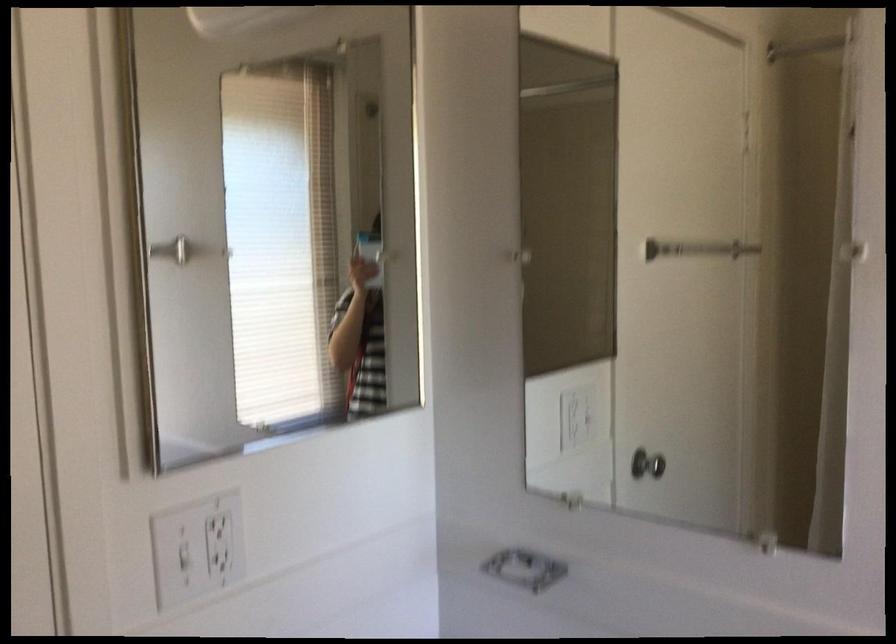
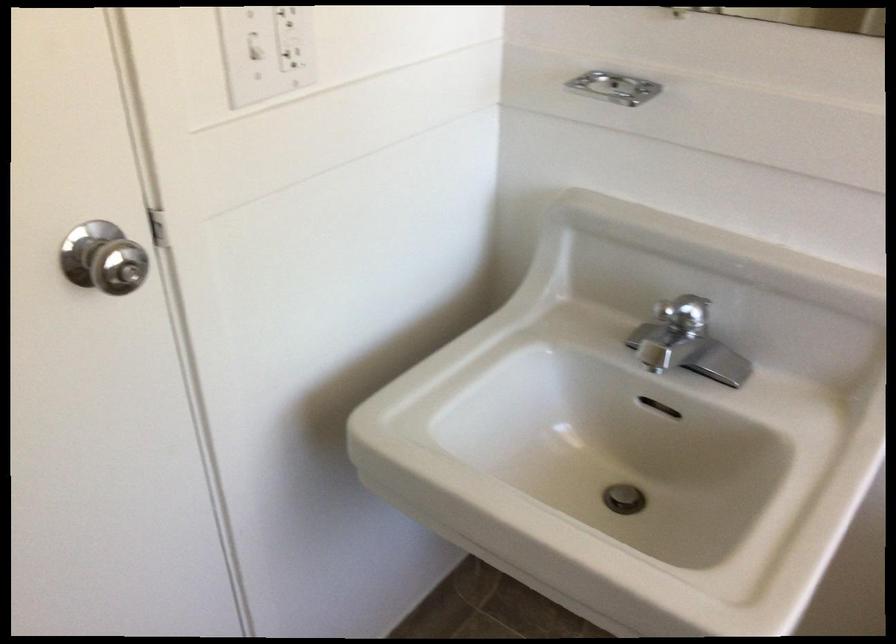
The point at [211,534] is marked in the first image. Where is the corresponding point in the second image?

(287, 15)